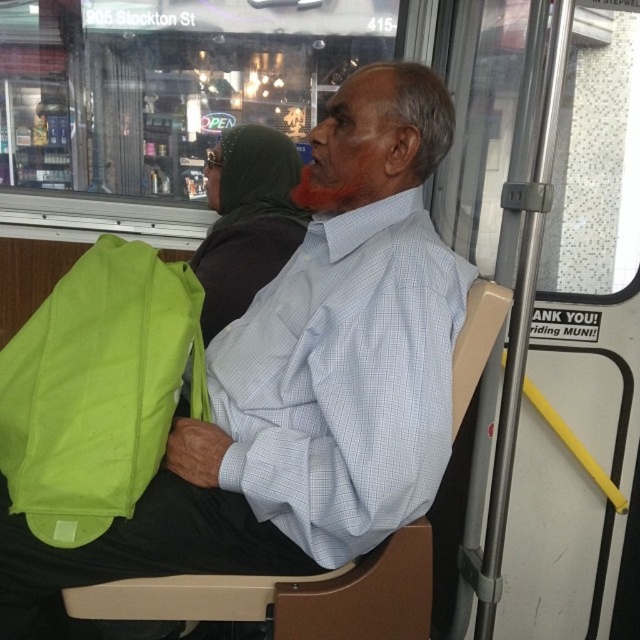
Question: Is green fabric bag at left above matte green bag at lower left?

Choices:
 (A) no
 (B) yes

Answer: (B)

Question: Which of the following is the farthest from the observer?

Choices:
 (A) (356, 628)
 (B) (144, 259)

Answer: (B)

Question: Can you confirm if green fabric bag at left is thinner than matte green bag at lower left?

Choices:
 (A) yes
 (B) no

Answer: (A)

Question: Is green fabric bag at left above matte green bag at lower left?

Choices:
 (A) no
 (B) yes

Answer: (B)

Question: Which point is farther to the camera?

Choices:
 (A) green fabric bag at left
 (B) matte green bag at lower left

Answer: (B)